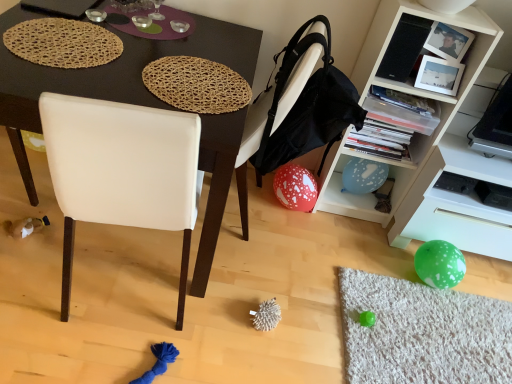
Locate an element on the screen. vacant area that lies in front of white matte cabinet at upper right is located at coordinates (355, 250).